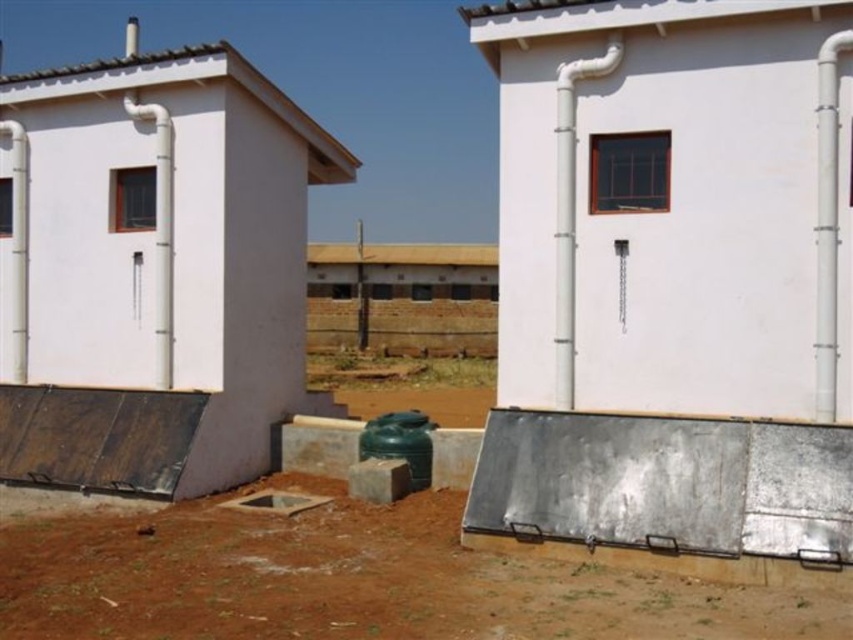
You are a delivery person trying to locate the entrance to the building. You see the white matte wall at center and the green matte water tank at center. Which object is closer to the ground?

The green matte water tank at center is closer to the ground because the white matte wall at center is located above it.

You are a delivery person trying to reach the green matte water tank at center. The ramp you need to use is the metallic gray ramp at lower right. Is the ramp above or below the water tank?

The metallic gray ramp at lower right is located above the green matte water tank at center, so the ramp is above the water tank.

You are a delivery person trying to park a 1.2 meter wide delivery van. You see the metallic gray ramp at lower right and the green matte water tank at center. Can the van fit through the space between the ramp and the water tank?

The metallic gray ramp at lower right is wider than the green matte water tank at center. Since the ramp is wider, the space between them might accommodate the van, but without exact distance measurements, it is uncertain. However, the ramp itself is 1.2 meters wide, so the van can fit if the gap between the ramp and the water tank is at least 1.2 meters.